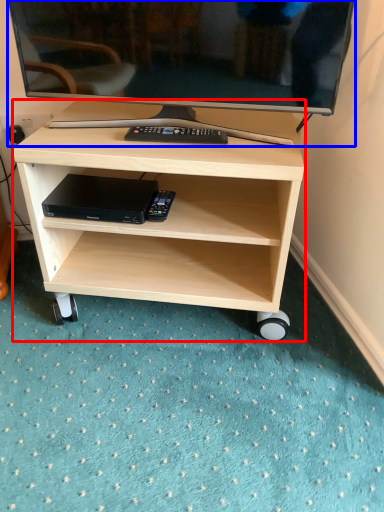
Question: Which of the following is the farthest to the observer, desk (highlighted by a red box) or television (highlighted by a blue box)?

Choices:
 (A) desk
 (B) television

Answer: (A)